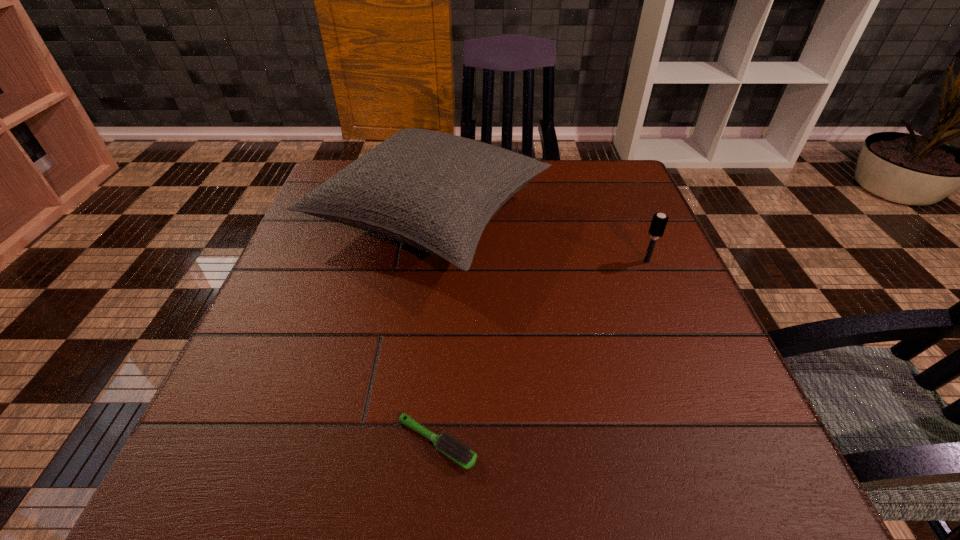
Where is `cushion`? The width and height of the screenshot is (960, 540). cushion is located at coordinates (434, 191).

You are a GUI agent. You are given a task and a screenshot of the screen. Output one action in this format:
    pyautogui.click(x=<x>, y=<y>)
    Task: Click on the right hairbrush
    
    Given the screenshot: What is the action you would take?
    pyautogui.click(x=659, y=221)

Locate an element on the screen. Image resolution: width=960 pixels, height=540 pixels. the farther hairbrush is located at coordinates tap(659, 221).

This screenshot has height=540, width=960. I want to click on the nearer hairbrush, so click(x=462, y=455).

Locate an element on the screen. The height and width of the screenshot is (540, 960). the nearest object is located at coordinates (462, 455).

Identify the location of vacant region located 0.050m on the right of the tallest object. The width and height of the screenshot is (960, 540). (572, 218).

At what (x,y) coordinates should I click in order to perform the action: click on free spot located on the front of the right hairbrush. Please return your answer as a coordinate pair (x, y). Looking at the image, I should click on (716, 428).

Identify the location of vacant region located on the right of the shortest object. (571, 443).

This screenshot has height=540, width=960. I want to click on object present at the far edge, so tap(434, 191).

Find the location of a particular element. object positioned at the near edge is located at coordinates (462, 455).